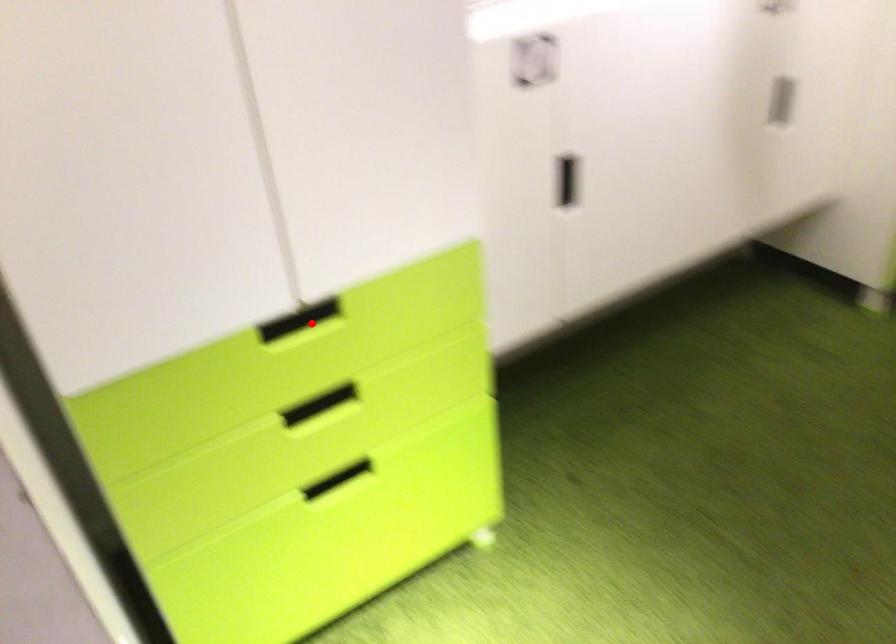
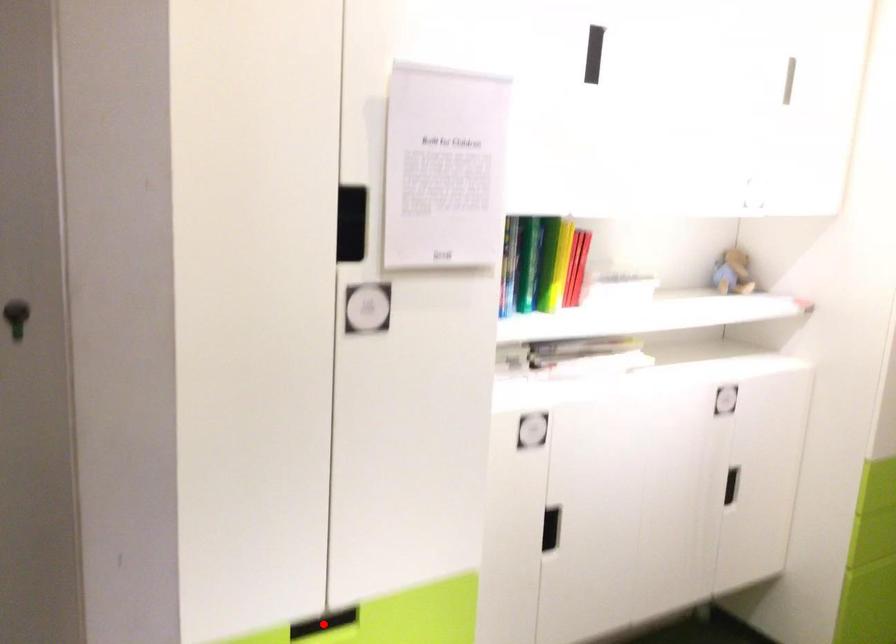
From the picture: I am providing you with two images of the same scene from different viewpoints. A red point is marked on the first image and another point is marked on the second image. Is the marked point in image1 the same physical position as the marked point in image2?

Yes